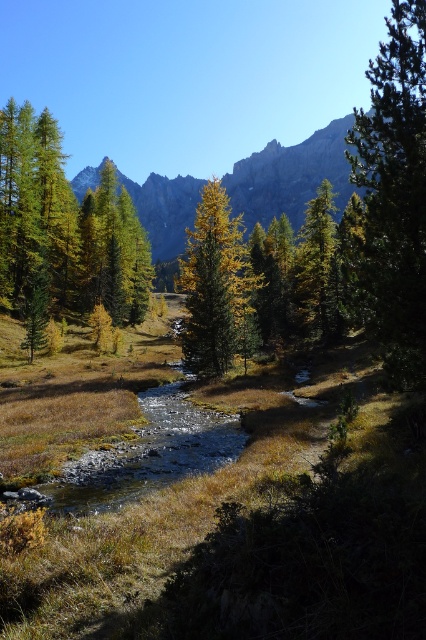
Is green leafy trees at upper center behind green matte tree at center?

Yes, green leafy trees at upper center is behind green matte tree at center.

What do you see at coordinates (290, 177) in the screenshot?
I see `green leafy trees at upper center` at bounding box center [290, 177].

Describe the element at coordinates (290, 177) in the screenshot. I see `green leafy trees at upper center` at that location.

Find the location of a particular element. Image resolution: width=426 pixels, height=640 pixels. green leafy trees at upper center is located at coordinates (290, 177).

Does green matte tree at left have a greater height compared to green matte tree at center?

Yes.

Who is more forward, (94,205) or (317,273)?

Point (317,273)

Image resolution: width=426 pixels, height=640 pixels. Identify the location of green matte tree at left. (66, 227).

Which of these two, green matte tree at left or green leafy trees at upper center, stands shorter?

Standing shorter between the two is green matte tree at left.

Does green matte tree at left have a larger size compared to green leafy trees at upper center?

No.

Where is `green matte tree at left`? This screenshot has width=426, height=640. green matte tree at left is located at coordinates click(x=66, y=227).